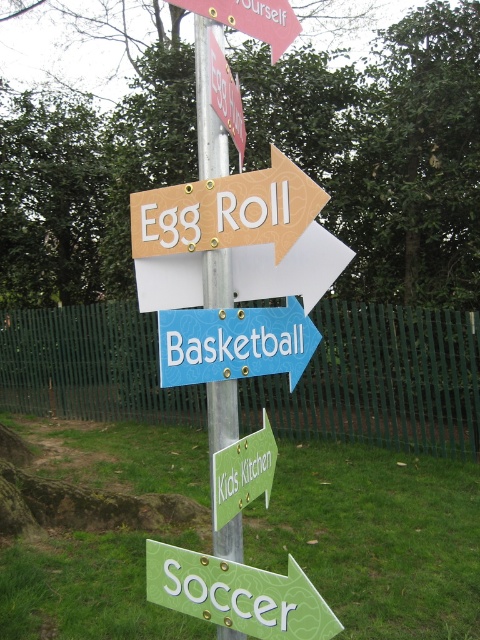
Question: Which of the following is the farthest from the observer?

Choices:
 (A) (205, 285)
 (B) (229, 364)

Answer: (A)

Question: Estimate the real-world distances between objects in this image. Which object is closer to the blue plastic basketball at center?

Choices:
 (A) green matte arrow at lower center
 (B) metallic pole at center

Answer: (B)

Question: Which point appears farthest from the camera in this image?

Choices:
 (A) (189, 228)
 (B) (216, 129)
 (C) (151, 586)
 (D) (162, 364)

Answer: (C)

Question: Can you confirm if green matte arrow at lower center is bigger than metallic pole at center?

Choices:
 (A) no
 (B) yes

Answer: (B)

Question: Can you confirm if matte wooden sign at upper center is positioned below blue plastic basketball at center?

Choices:
 (A) no
 (B) yes

Answer: (A)

Question: Does green matte arrow at lower center have a greater width compared to blue plastic basketball at center?

Choices:
 (A) no
 (B) yes

Answer: (B)